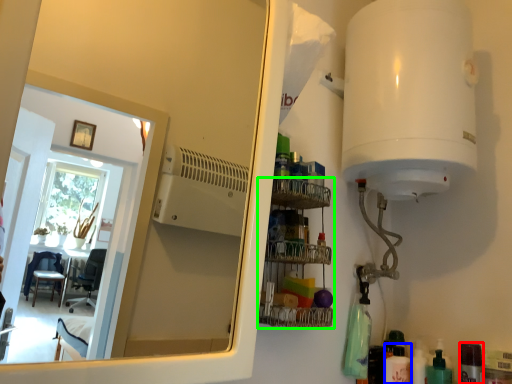
Question: Estimate the real-world distances between objects in this image. Which object is closer to toiletry (highlighted by a red box), toiletry (highlighted by a blue box) or shelf (highlighted by a green box)?

Choices:
 (A) toiletry
 (B) shelf

Answer: (A)